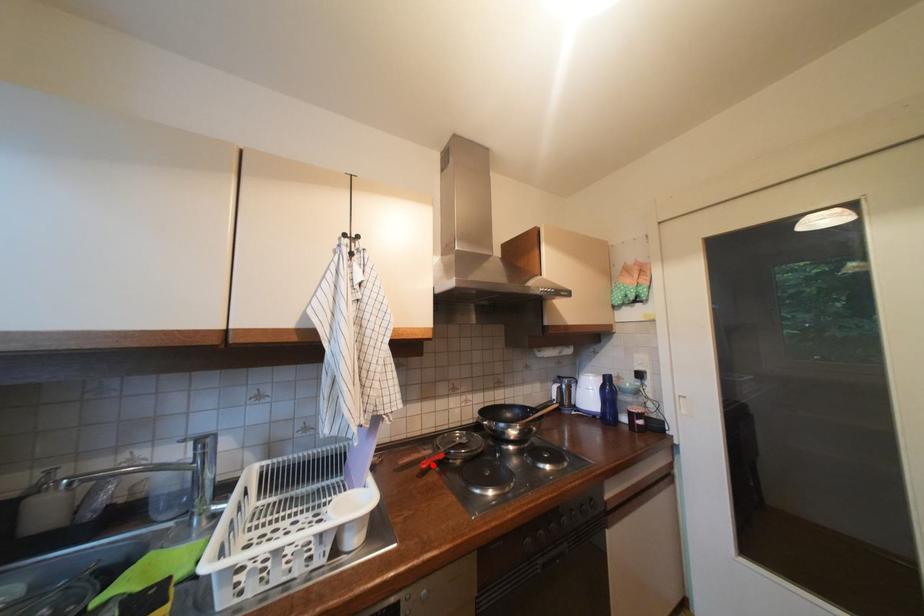
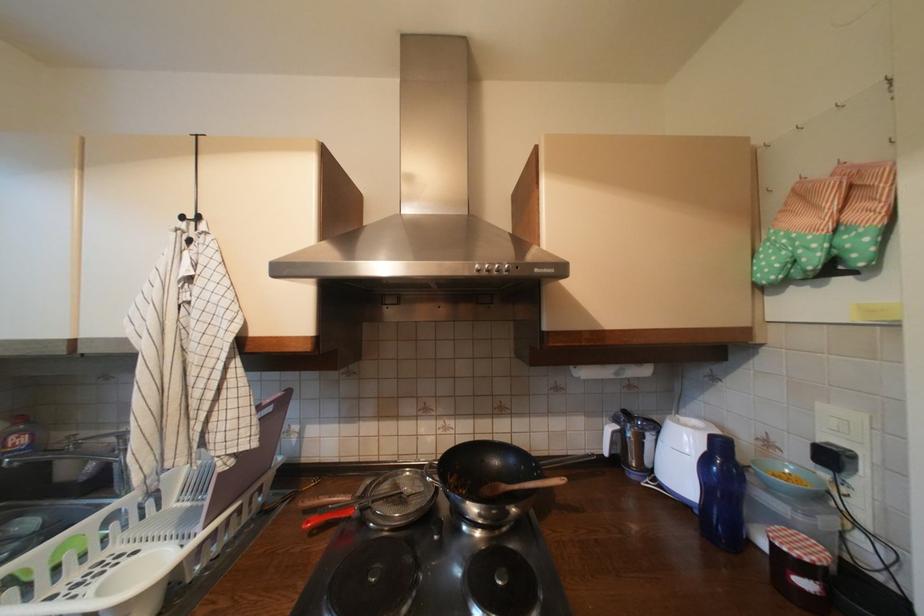
Locate, in the second image, the point that corresponds to the highlighted location in the first image.

(317, 524)